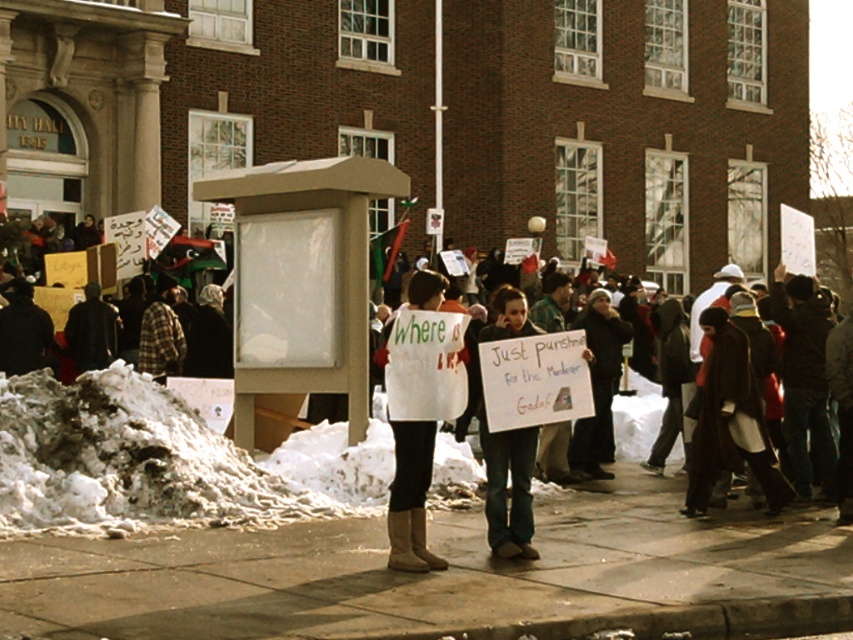
Which of these two, smooth concrete sidewalk at center or white fabric sign at center, stands taller?

Standing taller between the two is white fabric sign at center.

Measure the distance from smooth concrete sidewalk at center to white fabric sign at center.

smooth concrete sidewalk at center is 1.09 meters from white fabric sign at center.

Measure the distance between point (x=368, y=566) and camera.

Point (x=368, y=566) is 9.72 meters from camera.

Where is `smooth concrete sidewalk at center`? The image size is (853, 640). smooth concrete sidewalk at center is located at coordinates (447, 577).